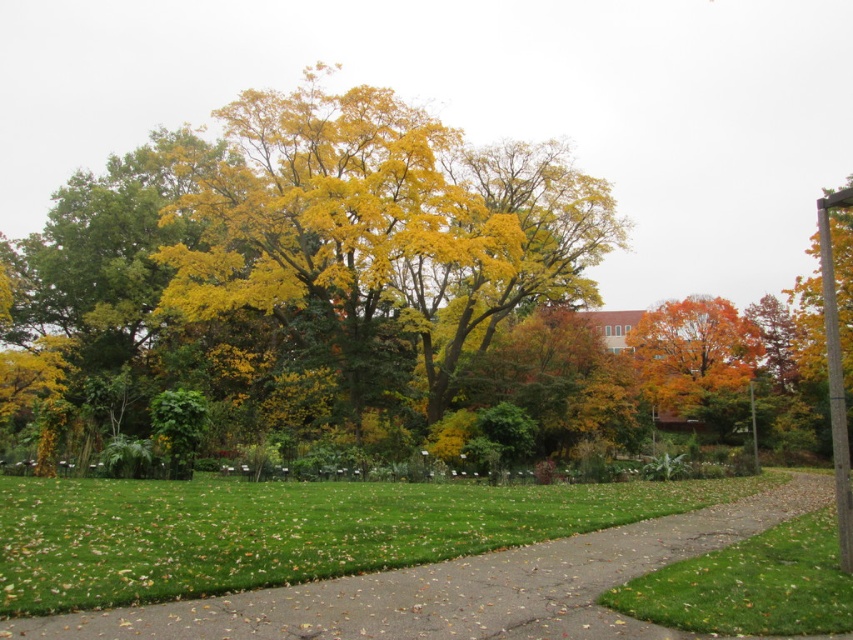
Question: Does green grass at lower right appear under orange autumn leaves at center?

Choices:
 (A) yes
 (B) no

Answer: (A)

Question: Estimate the real-world distances between objects in this image. Which object is closer to the orange autumn leaves at center?

Choices:
 (A) green concrete pavement at center
 (B) green grass at lower right

Answer: (A)

Question: Does yellow-green foliage at center have a lesser width compared to orange autumn leaves at center?

Choices:
 (A) yes
 (B) no

Answer: (B)

Question: Which point is closer to the camera?

Choices:
 (A) (680, 356)
 (B) (386, 148)

Answer: (B)

Question: Can you confirm if yellow-green foliage at center is bigger than green grass at lower right?

Choices:
 (A) no
 (B) yes

Answer: (B)

Question: Which of the following is the farthest from the observer?

Choices:
 (A) (318, 120)
 (B) (664, 339)
 (C) (712, 595)
 (D) (787, 497)

Answer: (B)